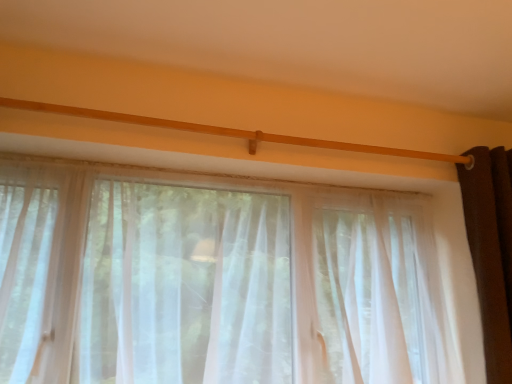
Locate an element on the screen. The image size is (512, 384). dark brown velvet curtain at right, which is the second curtain from left to right is located at coordinates (486, 262).

The image size is (512, 384). Describe the element at coordinates (486, 262) in the screenshot. I see `dark brown velvet curtain at right, the first curtain when ordered from right to left` at that location.

Measure the distance between dark brown velvet curtain at right, which is the second curtain from left to right, and camera.

A distance of 1.38 meters exists between dark brown velvet curtain at right, which is the second curtain from left to right, and camera.

What do you see at coordinates (214, 280) in the screenshot? I see `sheer white curtain at upper center, which is the first curtain in left-to-right order` at bounding box center [214, 280].

Where is `sheer white curtain at upper center, which is the first curtain in left-to-right order`? sheer white curtain at upper center, which is the first curtain in left-to-right order is located at coordinates (214, 280).

This screenshot has height=384, width=512. Identify the location of dark brown velvet curtain at right, which is the second curtain from left to right. (486, 262).

Which is more to the left, dark brown velvet curtain at right, the first curtain when ordered from right to left, or sheer white curtain at upper center, which is the first curtain in left-to-right order?

Positioned to the left is sheer white curtain at upper center, which is the first curtain in left-to-right order.

Between dark brown velvet curtain at right, which is the second curtain from left to right, and sheer white curtain at upper center, which is the first curtain in left-to-right order, which one is positioned behind?

dark brown velvet curtain at right, which is the second curtain from left to right, is further from the camera.

Which is in front, point (496, 337) or point (328, 263)?

The point (496, 337) is more forward.

From the image's perspective, is dark brown velvet curtain at right, which is the second curtain from left to right, over sheer white curtain at upper center, marked as the 2th curtain in a right-to-left arrangement?

Yes.

From a real-world perspective, which is physically above, dark brown velvet curtain at right, the first curtain when ordered from right to left, or sheer white curtain at upper center, which is the first curtain in left-to-right order?

dark brown velvet curtain at right, the first curtain when ordered from right to left.

Is dark brown velvet curtain at right, which is the second curtain from left to right, thinner than sheer white curtain at upper center, which is the first curtain in left-to-right order?

Indeed, dark brown velvet curtain at right, which is the second curtain from left to right, has a lesser width compared to sheer white curtain at upper center, which is the first curtain in left-to-right order.

From their relative heights in the image, would you say dark brown velvet curtain at right, which is the second curtain from left to right, is taller or shorter than sheer white curtain at upper center, which is the first curtain in left-to-right order?

dark brown velvet curtain at right, which is the second curtain from left to right, is taller than sheer white curtain at upper center, which is the first curtain in left-to-right order.

In terms of size, does dark brown velvet curtain at right, which is the second curtain from left to right, appear bigger or smaller than sheer white curtain at upper center, which is the first curtain in left-to-right order?

dark brown velvet curtain at right, which is the second curtain from left to right, is smaller than sheer white curtain at upper center, which is the first curtain in left-to-right order.

In the scene shown: Is dark brown velvet curtain at right, the first curtain when ordered from right to left, positioned beyond the bounds of sheer white curtain at upper center, which is the first curtain in left-to-right order?

dark brown velvet curtain at right, the first curtain when ordered from right to left, lies outside sheer white curtain at upper center, which is the first curtain in left-to-right order,'s area.

Is dark brown velvet curtain at right, which is the second curtain from left to right, next to sheer white curtain at upper center, which is the first curtain in left-to-right order, and touching it?

They are not placed beside each other.

Is dark brown velvet curtain at right, the first curtain when ordered from right to left, facing towards sheer white curtain at upper center, marked as the 2th curtain in a right-to-left arrangement?

No, dark brown velvet curtain at right, the first curtain when ordered from right to left, does not turn towards sheer white curtain at upper center, marked as the 2th curtain in a right-to-left arrangement.

How much distance is there between dark brown velvet curtain at right, which is the second curtain from left to right, and sheer white curtain at upper center, marked as the 2th curtain in a right-to-left arrangement?

dark brown velvet curtain at right, which is the second curtain from left to right, is 30.27 inches from sheer white curtain at upper center, marked as the 2th curtain in a right-to-left arrangement.

This screenshot has height=384, width=512. Find the location of `curtain behind the sheer white curtain at upper center, marked as the 2th curtain in a right-to-left arrangement`. curtain behind the sheer white curtain at upper center, marked as the 2th curtain in a right-to-left arrangement is located at coordinates (486, 262).

Is sheer white curtain at upper center, which is the first curtain in left-to-right order, to the left of dark brown velvet curtain at right, which is the second curtain from left to right, from the viewer's perspective?

Correct, you'll find sheer white curtain at upper center, which is the first curtain in left-to-right order, to the left of dark brown velvet curtain at right, which is the second curtain from left to right.

Between sheer white curtain at upper center, which is the first curtain in left-to-right order, and dark brown velvet curtain at right, the first curtain when ordered from right to left, which one is positioned in front?

sheer white curtain at upper center, which is the first curtain in left-to-right order, is more forward.

Which point is more forward, (35,356) or (497,293)?

The point (35,356) is closer to the camera.

From the image's perspective, is sheer white curtain at upper center, which is the first curtain in left-to-right order, located beneath dark brown velvet curtain at right, which is the second curtain from left to right?

Yes.

From a real-world perspective, is sheer white curtain at upper center, which is the first curtain in left-to-right order, over dark brown velvet curtain at right, which is the second curtain from left to right?

No, from a real-world perspective, sheer white curtain at upper center, which is the first curtain in left-to-right order, is not above dark brown velvet curtain at right, which is the second curtain from left to right.

In terms of width, does sheer white curtain at upper center, marked as the 2th curtain in a right-to-left arrangement, look wider or thinner when compared to dark brown velvet curtain at right, which is the second curtain from left to right?

sheer white curtain at upper center, marked as the 2th curtain in a right-to-left arrangement, is wider than dark brown velvet curtain at right, which is the second curtain from left to right.

Consider the image. Does sheer white curtain at upper center, which is the first curtain in left-to-right order, have a lesser height compared to dark brown velvet curtain at right, which is the second curtain from left to right?

Yes.

Is sheer white curtain at upper center, marked as the 2th curtain in a right-to-left arrangement, bigger or smaller than dark brown velvet curtain at right, the first curtain when ordered from right to left?

sheer white curtain at upper center, marked as the 2th curtain in a right-to-left arrangement, is bigger than dark brown velvet curtain at right, the first curtain when ordered from right to left.

Would you say sheer white curtain at upper center, which is the first curtain in left-to-right order, is outside dark brown velvet curtain at right, the first curtain when ordered from right to left?

Indeed, sheer white curtain at upper center, which is the first curtain in left-to-right order, is completely outside dark brown velvet curtain at right, the first curtain when ordered from right to left.

Is sheer white curtain at upper center, marked as the 2th curtain in a right-to-left arrangement, far from dark brown velvet curtain at right, which is the second curtain from left to right?

That's not correct — sheer white curtain at upper center, marked as the 2th curtain in a right-to-left arrangement, is a little close to dark brown velvet curtain at right, which is the second curtain from left to right.

Is sheer white curtain at upper center, marked as the 2th curtain in a right-to-left arrangement, oriented away from dark brown velvet curtain at right, which is the second curtain from left to right?

No, dark brown velvet curtain at right, which is the second curtain from left to right, is not at the back of sheer white curtain at upper center, marked as the 2th curtain in a right-to-left arrangement.

Identify the location of curtain that is above the sheer white curtain at upper center, marked as the 2th curtain in a right-to-left arrangement (from a real-world perspective). The height and width of the screenshot is (384, 512). (486, 262).

Where is `curtain that is behind the sheer white curtain at upper center, marked as the 2th curtain in a right-to-left arrangement`? The height and width of the screenshot is (384, 512). curtain that is behind the sheer white curtain at upper center, marked as the 2th curtain in a right-to-left arrangement is located at coordinates (486, 262).

Find the location of a particular element. The image size is (512, 384). curtain above the sheer white curtain at upper center, marked as the 2th curtain in a right-to-left arrangement (from the image's perspective) is located at coordinates (486, 262).